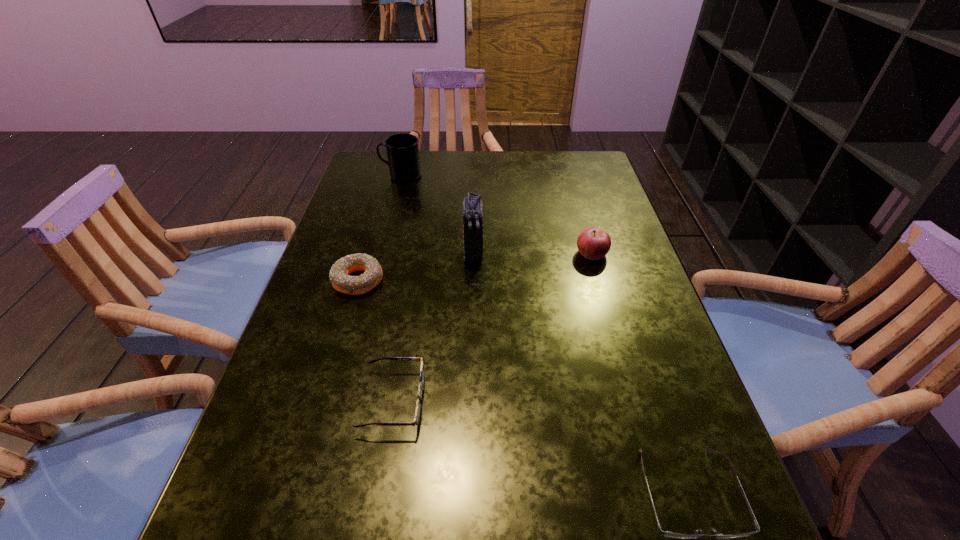
Identify the location of clutch bag. The image size is (960, 540). (473, 231).

Find the location of a particular element. the tallest object is located at coordinates (473, 231).

What are the coordinates of `mug` in the screenshot? It's located at (402, 149).

Locate an element on the screen. This screenshot has width=960, height=540. the fifth shortest object is located at coordinates (402, 149).

The height and width of the screenshot is (540, 960). I want to click on apple, so click(593, 243).

You are a GUI agent. You are given a task and a screenshot of the screen. Output one action in this format:
    pyautogui.click(x=<x>, y=<y>)
    Task: Click on the doughnut
    The width and height of the screenshot is (960, 540).
    Given the screenshot: What is the action you would take?
    (x=339, y=276)

Where is `the taller spectacles`? This screenshot has height=540, width=960. the taller spectacles is located at coordinates (417, 417).

Identify the location of the left spectacles. The height and width of the screenshot is (540, 960). (417, 417).

Locate an element on the screen. This screenshot has height=540, width=960. blank space located with the zip open on the clutch bag is located at coordinates (471, 373).

Locate an element on the screen. This screenshot has width=960, height=540. free space located 0.060m on the side of the mug with the handle is located at coordinates (362, 176).